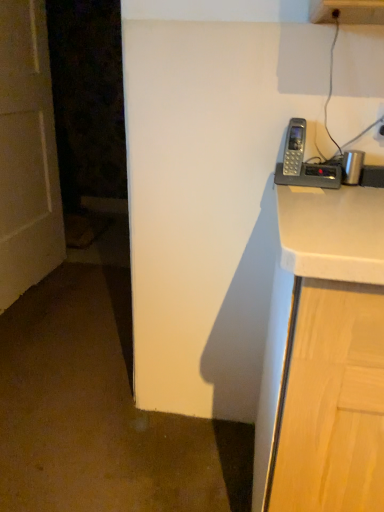
Question: Is white matte door at left at the left side of gray plastic phone at upper right?

Choices:
 (A) no
 (B) yes

Answer: (B)

Question: Can gray plastic phone at upper right be found inside white matte door at left?

Choices:
 (A) yes
 (B) no

Answer: (B)

Question: Does white matte door at left touch gray plastic phone at upper right?

Choices:
 (A) no
 (B) yes

Answer: (A)

Question: Does white matte door at left have a larger size compared to gray plastic phone at upper right?

Choices:
 (A) yes
 (B) no

Answer: (A)

Question: From the image's perspective, does white matte door at left appear higher than gray plastic phone at upper right?

Choices:
 (A) yes
 (B) no

Answer: (A)

Question: From a real-world perspective, is white matte door at left above or below gray plastic phone at upper right?

Choices:
 (A) above
 (B) below

Answer: (B)

Question: Considering the relative positions of white matte door at left and gray plastic phone at upper right in the image provided, is white matte door at left to the left or to the right of gray plastic phone at upper right?

Choices:
 (A) left
 (B) right

Answer: (A)

Question: Considering the positions of white matte door at left and gray plastic phone at upper right in the image, is white matte door at left wider or thinner than gray plastic phone at upper right?

Choices:
 (A) wide
 (B) thin

Answer: (B)

Question: From the image's perspective, is white matte door at left positioned above or below gray plastic phone at upper right?

Choices:
 (A) below
 (B) above

Answer: (B)

Question: Considering their positions, is gray plastic phone at upper right located in front of or behind white plastic electric outlet at upper right?

Choices:
 (A) front
 (B) behind

Answer: (A)

Question: Does point (289, 147) appear closer or farther from the camera than point (379, 132)?

Choices:
 (A) farther
 (B) closer

Answer: (B)

Question: Is gray plastic phone at upper right spatially inside white plastic electric outlet at upper right, or outside of it?

Choices:
 (A) outside
 (B) inside

Answer: (A)

Question: Based on their positions, is gray plastic phone at upper right located to the left or right of white plastic electric outlet at upper right?

Choices:
 (A) left
 (B) right

Answer: (A)

Question: In terms of size, does white plastic electric outlet at upper right appear bigger or smaller than gray plastic phone at upper right?

Choices:
 (A) small
 (B) big

Answer: (A)

Question: Considering the positions of point (377, 138) and point (329, 168), is point (377, 138) closer or farther from the camera than point (329, 168)?

Choices:
 (A) farther
 (B) closer

Answer: (A)